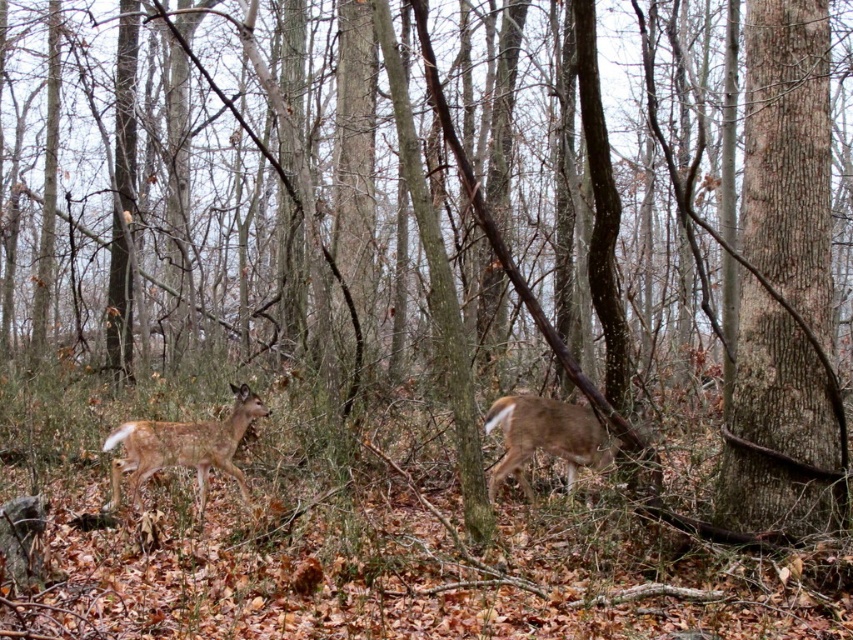
Question: Which of the following is the farthest from the observer?

Choices:
 (A) (137, 448)
 (B) (825, 220)
 (C) (601, 449)

Answer: (C)

Question: Does fawn fur deer at center have a larger size compared to brown fur deer at center?

Choices:
 (A) yes
 (B) no

Answer: (B)

Question: Can you confirm if smooth brown tree trunk at right is positioned above fawn fur deer at center?

Choices:
 (A) no
 (B) yes

Answer: (B)

Question: Can you confirm if fawn fur deer at center is bigger than brown fur deer at center?

Choices:
 (A) yes
 (B) no

Answer: (B)

Question: Which object is positioned farthest from the brown fur deer at center?

Choices:
 (A) fawn fur deer at center
 (B) smooth brown tree trunk at right

Answer: (A)

Question: Among these objects, which one is farthest from the camera?

Choices:
 (A) brown fur deer at center
 (B) smooth brown tree trunk at right

Answer: (A)